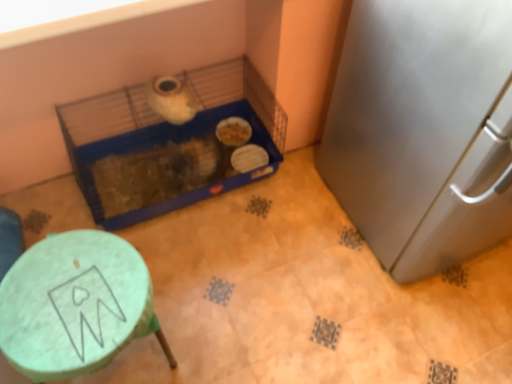
Question: From the image's perspective, is blue plastic bird cage at center located above or below dark brown textured bedding at center?

Choices:
 (A) below
 (B) above

Answer: (B)

Question: Would you say blue plastic bird cage at center is to the left or to the right of dark brown textured bedding at center in the picture?

Choices:
 (A) left
 (B) right

Answer: (B)

Question: Estimate the real-world distances between objects in this image. Which object is farther from the satin silver refrigerator at right?

Choices:
 (A) dark brown textured bedding at center
 (B) green matte stool at lower left
 (C) blue plastic bird cage at center

Answer: (B)

Question: Which object is the closest to the satin silver refrigerator at right?

Choices:
 (A) dark brown textured bedding at center
 (B) blue plastic bird cage at center
 (C) green matte stool at lower left

Answer: (B)